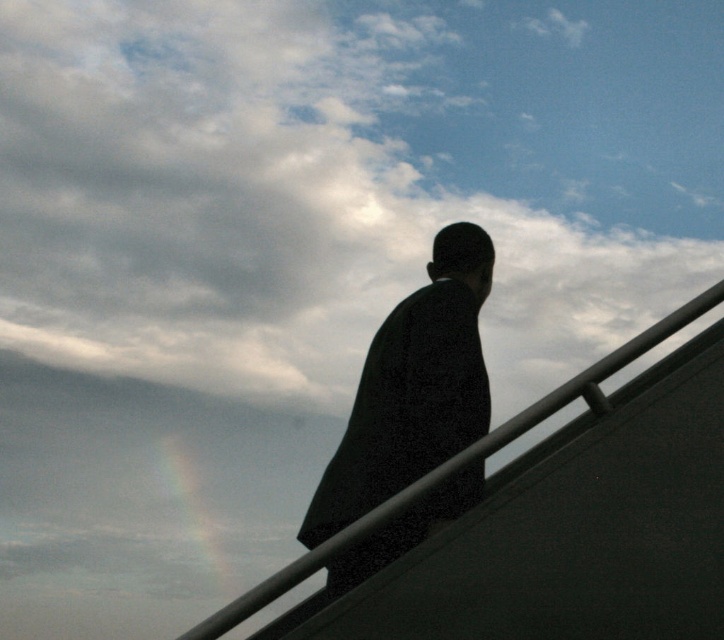
Question: Which object appears closest to the camera in this image?

Choices:
 (A) black matte suit at center
 (B) cloudy sky at upper center

Answer: (A)

Question: Which point is farther to the camera?

Choices:
 (A) cloudy sky at upper center
 (B) black matte suit at center

Answer: (A)

Question: Can you confirm if cloudy sky at upper center is positioned to the left of black matte suit at center?

Choices:
 (A) no
 (B) yes

Answer: (B)

Question: Does cloudy sky at upper center come behind black matte suit at center?

Choices:
 (A) yes
 (B) no

Answer: (A)

Question: Does cloudy sky at upper center lie in front of black matte suit at center?

Choices:
 (A) no
 (B) yes

Answer: (A)